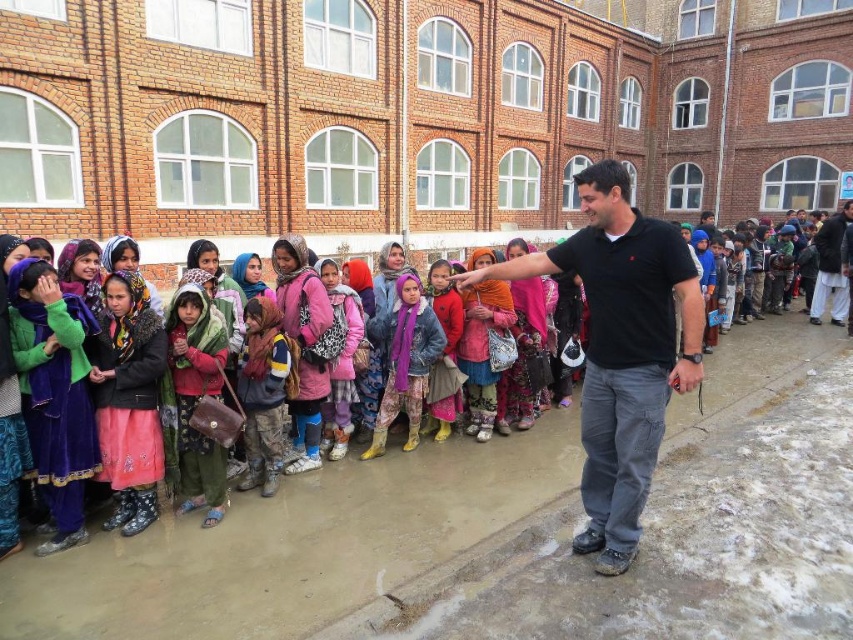
Which of these two, floral fabric skirt at center or floral fabric dress at center, stands shorter?

With less height is floral fabric skirt at center.

Which is in front, point (96, 428) or point (500, 330)?

Point (96, 428) is more forward.

Is point (148, 417) more distant than point (486, 404)?

No, (148, 417) is closer to viewer.

This screenshot has height=640, width=853. In order to click on floral fabric skirt at center in this screenshot , I will do `click(129, 401)`.

Is purple wool scarf at center taller than multicolored fabric dress at center?

No.

Which is more to the left, purple wool scarf at center or multicolored fabric dress at center?

From the viewer's perspective, purple wool scarf at center appears more on the left side.

Which is behind, point (393, 310) or point (462, 324)?

Positioned behind is point (393, 310).

This screenshot has width=853, height=640. Find the location of `purple wool scarf at center`. purple wool scarf at center is located at coordinates (405, 362).

Who is shorter, black cotton shirt at center or floral fabric dress at center?

floral fabric dress at center

Does black cotton shirt at center have a larger size compared to floral fabric dress at center?

Yes.

What do you see at coordinates (621, 349) in the screenshot? Image resolution: width=853 pixels, height=640 pixels. I see `black cotton shirt at center` at bounding box center [621, 349].

You are a GUI agent. You are given a task and a screenshot of the screen. Output one action in this format:
    pyautogui.click(x=<x>, y=<y>)
    Task: Click on the black cotton shirt at center
    
    Given the screenshot: What is the action you would take?
    pyautogui.click(x=621, y=349)